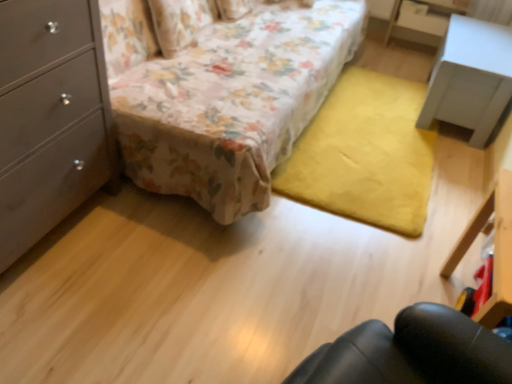
Question: Can you confirm if matte gray dresser at left is taller than black plastic vanity at lower right?

Choices:
 (A) no
 (B) yes

Answer: (B)

Question: From the image's perspective, is matte gray dresser at left below black plastic vanity at lower right?

Choices:
 (A) no
 (B) yes

Answer: (A)

Question: Considering the relative positions of matte gray dresser at left and black plastic vanity at lower right in the image provided, is matte gray dresser at left behind black plastic vanity at lower right?

Choices:
 (A) yes
 (B) no

Answer: (B)

Question: Can you confirm if matte gray dresser at left is bigger than black plastic vanity at lower right?

Choices:
 (A) no
 (B) yes

Answer: (B)

Question: Does matte gray dresser at left touch black plastic vanity at lower right?

Choices:
 (A) yes
 (B) no

Answer: (B)

Question: From a real-world perspective, is matte gray dresser at left located higher than black plastic vanity at lower right?

Choices:
 (A) no
 (B) yes

Answer: (B)

Question: From a real-world perspective, is white matte nightstand at upper right below matte gray dresser at left?

Choices:
 (A) no
 (B) yes

Answer: (B)

Question: Considering the relative positions of white matte nightstand at upper right and matte gray dresser at left in the image provided, is white matte nightstand at upper right to the right of matte gray dresser at left from the viewer's perspective?

Choices:
 (A) yes
 (B) no

Answer: (A)

Question: Is white matte nightstand at upper right at the left side of matte gray dresser at left?

Choices:
 (A) no
 (B) yes

Answer: (A)

Question: Does white matte nightstand at upper right touch matte gray dresser at left?

Choices:
 (A) yes
 (B) no

Answer: (B)

Question: Is the depth of white matte nightstand at upper right less than that of matte gray dresser at left?

Choices:
 (A) yes
 (B) no

Answer: (B)

Question: Considering the relative sizes of white matte nightstand at upper right and matte gray dresser at left in the image provided, is white matte nightstand at upper right shorter than matte gray dresser at left?

Choices:
 (A) no
 (B) yes

Answer: (B)

Question: Is floral fabric couch at center looking in the opposite direction of matte gray dresser at left?

Choices:
 (A) no
 (B) yes

Answer: (A)